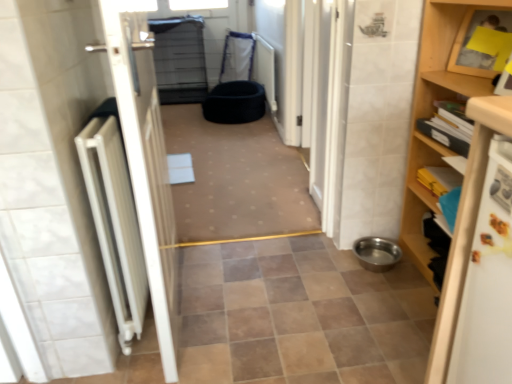
Question: From a real-world perspective, is black fabric pet bed at center, the 2th toilet bowl positioned from the right, above or below metallic stainless steel bowl at lower right, the first toilet bowl in the front-to-back sequence?

Choices:
 (A) below
 (B) above

Answer: (B)

Question: From the image's perspective, relative to metallic stainless steel bowl at lower right, which is the second toilet bowl from back to front, is black fabric pet bed at center, which is counted as the second toilet bowl, starting from the bottom, above or below?

Choices:
 (A) above
 (B) below

Answer: (A)

Question: Estimate the real-world distances between objects in this image. Which object is farther from the white matte door at left?

Choices:
 (A) metallic stainless steel bowl at lower right, which is the second toilet bowl from back to front
 (B) black fabric pet bed at center, positioned as the first toilet bowl in left-to-right order
 (C) wooden shelf at right
 (D) black fabric pet bed at center
 (E) white metallic radiator at left

Answer: (B)

Question: Estimate the real-world distances between objects in this image. Which object is closer to the white metallic radiator at left?

Choices:
 (A) black fabric pet bed at center, which is counted as the second toilet bowl, starting from the bottom
 (B) metallic stainless steel bowl at lower right, which is the second toilet bowl from back to front
 (C) wooden shelf at right
 (D) black fabric pet bed at center
 (E) white glossy refrigerator at right

Answer: (E)